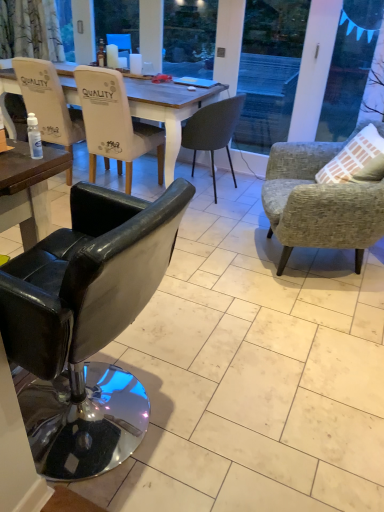
Question: From a real-world perspective, is white glossy coffee cup at upper center on top of white leather chair at left, placed as the first chair when sorted from left to right?

Choices:
 (A) yes
 (B) no

Answer: (A)

Question: Is white glossy coffee cup at upper center next to white leather chair at left, placed as the 5th chair when sorted from right to left, and touching it?

Choices:
 (A) yes
 (B) no

Answer: (B)

Question: Is white glossy coffee cup at upper center not near white leather chair at left, placed as the first chair when sorted from left to right?

Choices:
 (A) no
 (B) yes

Answer: (A)

Question: Does white glossy coffee cup at upper center have a greater height compared to white leather chair at left, placed as the 5th chair when sorted from right to left?

Choices:
 (A) yes
 (B) no

Answer: (B)

Question: Would you say white leather chair at left, placed as the first chair when sorted from left to right, is part of white glossy coffee cup at upper center's contents?

Choices:
 (A) yes
 (B) no

Answer: (B)

Question: From a real-world perspective, is white glossy coffee cup at upper center located beneath white leather chair at left, placed as the first chair when sorted from left to right?

Choices:
 (A) yes
 (B) no

Answer: (B)

Question: Is transparent plastic bottle at lower left far from black leather chair at left, arranged as the third chair when viewed from the right?

Choices:
 (A) no
 (B) yes

Answer: (B)

Question: Considering the relative sizes of transparent plastic bottle at lower left and black leather chair at left, which ranks as the third chair in left-to-right order, in the image provided, is transparent plastic bottle at lower left shorter than black leather chair at left, which ranks as the third chair in left-to-right order,?

Choices:
 (A) no
 (B) yes

Answer: (B)

Question: Is transparent plastic bottle at lower left not inside black leather chair at left, arranged as the third chair when viewed from the right?

Choices:
 (A) yes
 (B) no

Answer: (A)

Question: Considering the relative sizes of transparent plastic bottle at lower left and black leather chair at left, which ranks as the third chair in left-to-right order, in the image provided, is transparent plastic bottle at lower left taller than black leather chair at left, which ranks as the third chair in left-to-right order,?

Choices:
 (A) yes
 (B) no

Answer: (B)

Question: Is transparent plastic bottle at lower left aimed at black leather chair at left, arranged as the third chair when viewed from the right?

Choices:
 (A) yes
 (B) no

Answer: (B)

Question: Can you confirm if transparent plastic bottle at lower left is bigger than black leather chair at left, arranged as the third chair when viewed from the right?

Choices:
 (A) no
 (B) yes

Answer: (A)

Question: Is transparent plastic bottle at lower left next to white glossy coffee cup at upper center and touching it?

Choices:
 (A) no
 (B) yes

Answer: (A)